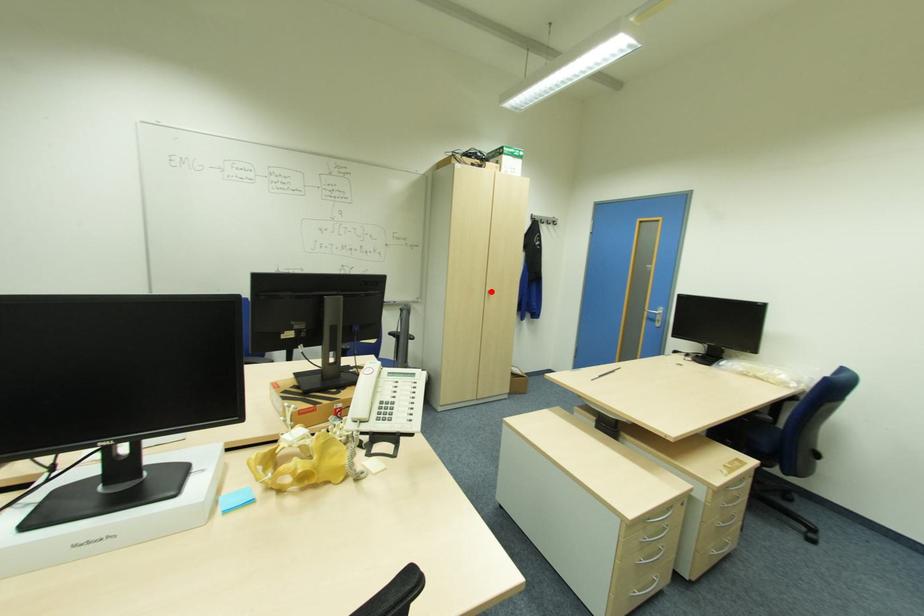
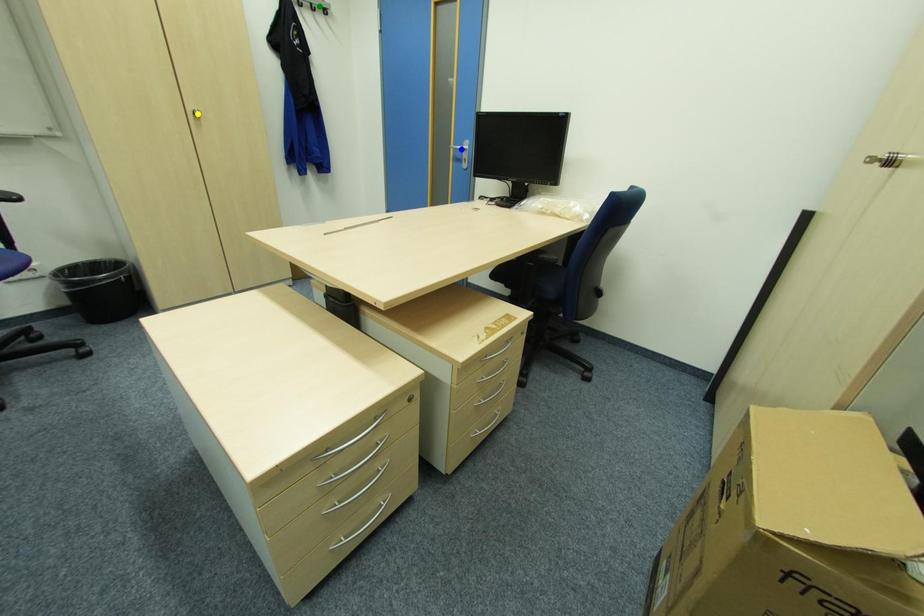
Question: I am providing you with two images of the same scene from different viewpoints. A red point is marked on the first image. You are given multiple points on the second image. In image 2, which mark is for the same physical point as the one in image 1?

Choices:
 (A) green point
 (B) blue point
 (C) yellow point

Answer: (C)